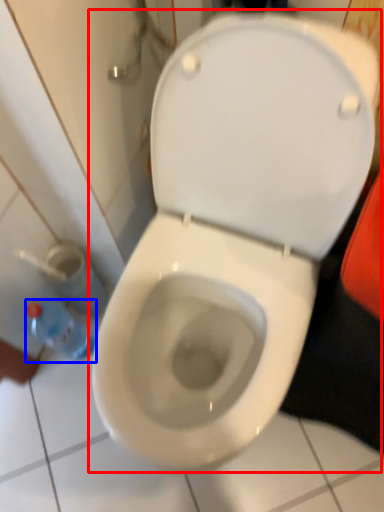
Question: Which object is closer to the camera taking this photo, toilet (highlighted by a red box) or bottle (highlighted by a blue box)?

Choices:
 (A) toilet
 (B) bottle

Answer: (A)